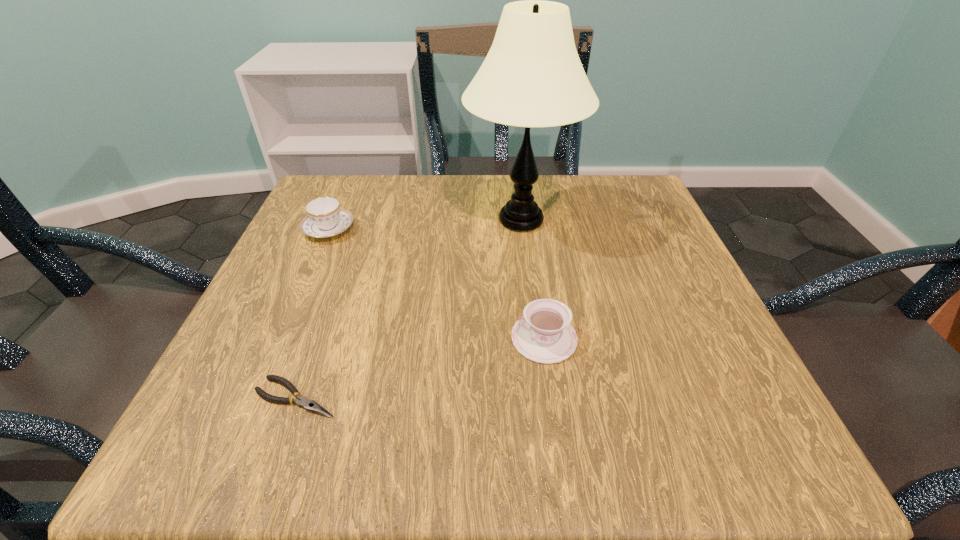
You are a GUI agent. You are given a task and a screenshot of the screen. Output one action in this format:
    pyautogui.click(x=<x>, y=<y>)
    Task: Click on the vacant area situated 0.210m on the handle side of the right teacup
    The height and width of the screenshot is (540, 960).
    Given the screenshot: What is the action you would take?
    pyautogui.click(x=379, y=338)

Where is `blank space located 0.320m on the back of the pliers`? Image resolution: width=960 pixels, height=540 pixels. blank space located 0.320m on the back of the pliers is located at coordinates (350, 245).

Where is `lamp located at the far edge`? The height and width of the screenshot is (540, 960). lamp located at the far edge is located at coordinates (532, 76).

This screenshot has height=540, width=960. In order to click on teacup present at the far edge in this screenshot , I will do `click(325, 218)`.

Locate an element on the screen. object that is at the near edge is located at coordinates (309, 405).

Locate an element on the screen. This screenshot has height=540, width=960. teacup that is at the left edge is located at coordinates (325, 218).

Find the location of `pliers that is at the left edge`. pliers that is at the left edge is located at coordinates (309, 405).

Find the location of a particular element. object positioned at the far left corner is located at coordinates (325, 218).

The height and width of the screenshot is (540, 960). What are the coordinates of `object located at the near left corner` in the screenshot? It's located at (309, 405).

In the image, there is a desktop. Identify the location of vacant space at the far edge. (564, 189).